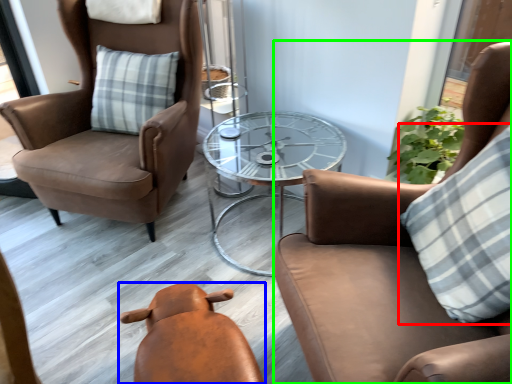
Question: Considering the real-world distances, which object is closest to pillow (highlighted by a red box)? chair (highlighted by a blue box) or chair (highlighted by a green box).

Choices:
 (A) chair
 (B) chair

Answer: (B)